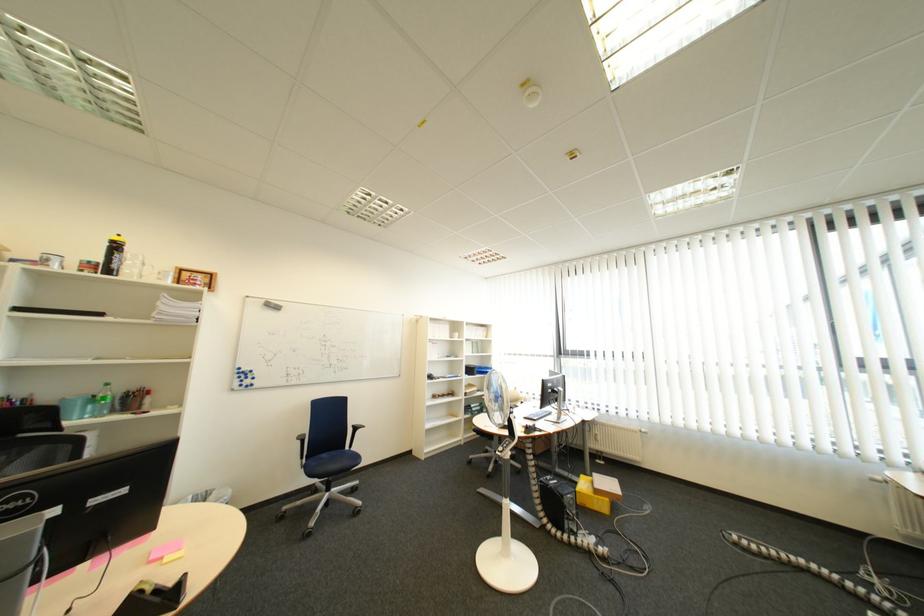
Find where to lift the stack of papers. Please return your answer as a coordinate pair (x, y).

(176, 310)